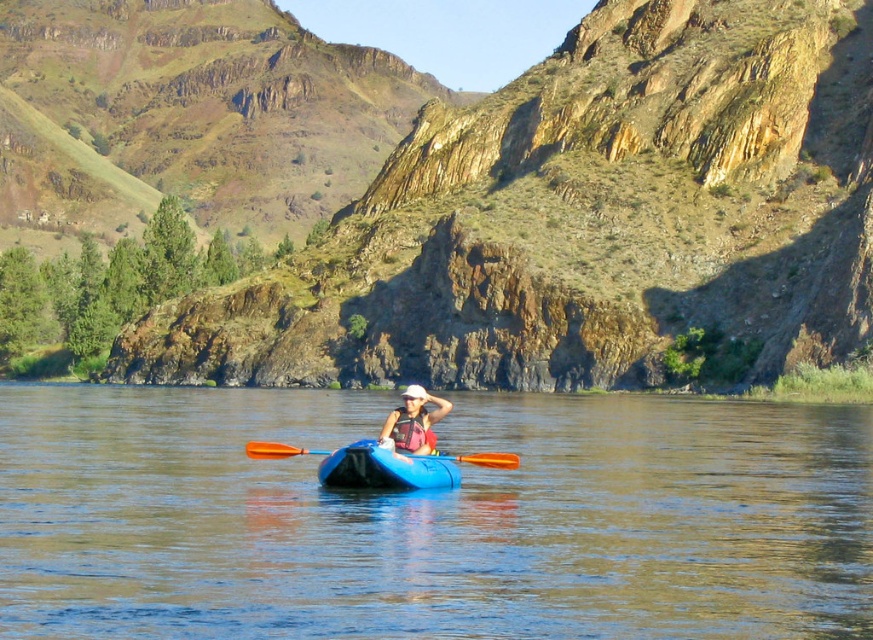
Question: Is blue plastic kayak at center to the right of matte pink life vest at center from the viewer's perspective?

Choices:
 (A) yes
 (B) no

Answer: (A)

Question: Estimate the real-world distances between objects in this image. Which object is closer to the orange wood paddle at center?

Choices:
 (A) blue plastic kayak at center
 (B) matte pink life vest at center
 (C) blue plastic canoe at center

Answer: (C)

Question: Based on their relative distances, which object is nearer to the orange wood paddle at center?

Choices:
 (A) blue plastic kayak at center
 (B) matte pink life vest at center
 (C) blue plastic canoe at center

Answer: (C)

Question: Which point is farther to the camera?

Choices:
 (A) orange wood paddle at center
 (B) blue plastic kayak at center

Answer: (A)

Question: Is blue plastic canoe at center closer to the viewer compared to matte pink life vest at center?

Choices:
 (A) no
 (B) yes

Answer: (B)

Question: Is blue plastic canoe at center above orange wood paddle at center?

Choices:
 (A) no
 (B) yes

Answer: (B)